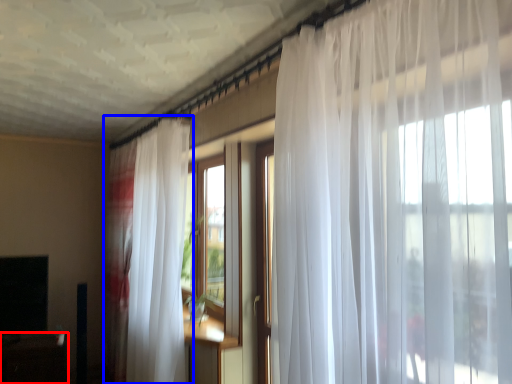
Question: Which of the following is the farthest to the observer, table (highlighted by a red box) or curtain (highlighted by a blue box)?

Choices:
 (A) table
 (B) curtain

Answer: (A)